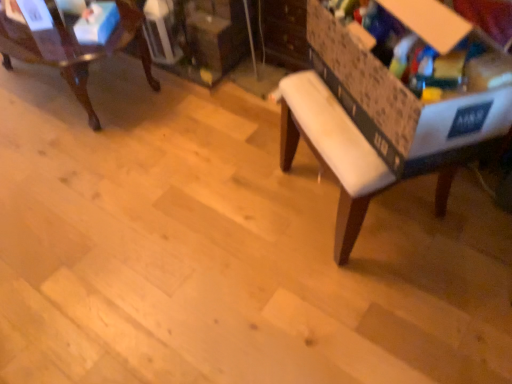
Question: Looking at their shapes, would you say blue cardboard box at upper left, the 2th storage box from the right, is wider or thinner than cardboard storage box at right, positioned as the 2th storage box in left-to-right order?

Choices:
 (A) thin
 (B) wide

Answer: (A)

Question: Is blue cardboard box at upper left, which is the 2th storage box in front-to-back order, spatially inside cardboard storage box at right, the first storage box viewed from the front, or outside of it?

Choices:
 (A) outside
 (B) inside

Answer: (A)

Question: Which object is the closest to the mahogany wood chair at upper left?

Choices:
 (A) cardboard storage box at right, positioned as the 2th storage box in left-to-right order
 (B) blue cardboard box at upper left, the 2th storage box from the right
 (C) white fabric bench at center

Answer: (B)

Question: Estimate the real-world distances between objects in this image. Which object is closer to the white fabric bench at center?

Choices:
 (A) mahogany wood chair at upper left
 (B) blue cardboard box at upper left, which is counted as the first storage box, starting from the back
 (C) cardboard storage box at right, the first storage box viewed from the front

Answer: (C)